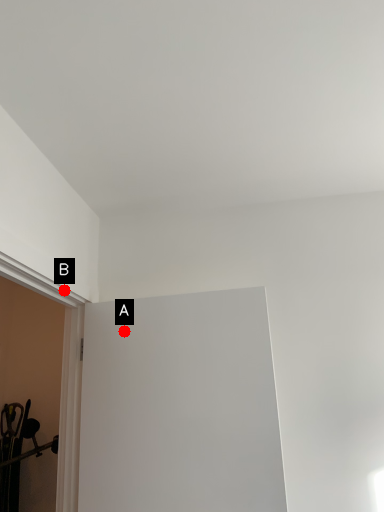
Question: Two points are circled on the image, labeled by A and B beside each circle. Which point is closer to the camera?

Choices:
 (A) A is closer
 (B) B is closer

Answer: (B)